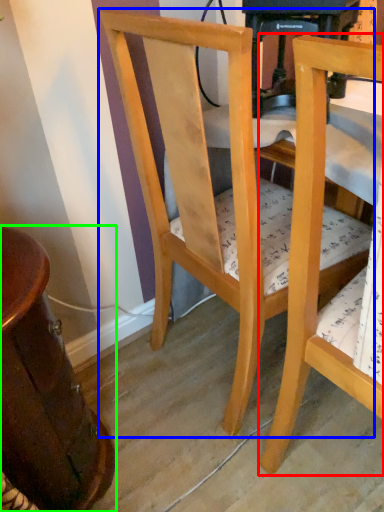
Question: Estimate the real-world distances between objects in this image. Which object is closer to chair (highlighted by a red box), chair (highlighted by a blue box) or table (highlighted by a green box)?

Choices:
 (A) chair
 (B) table

Answer: (A)